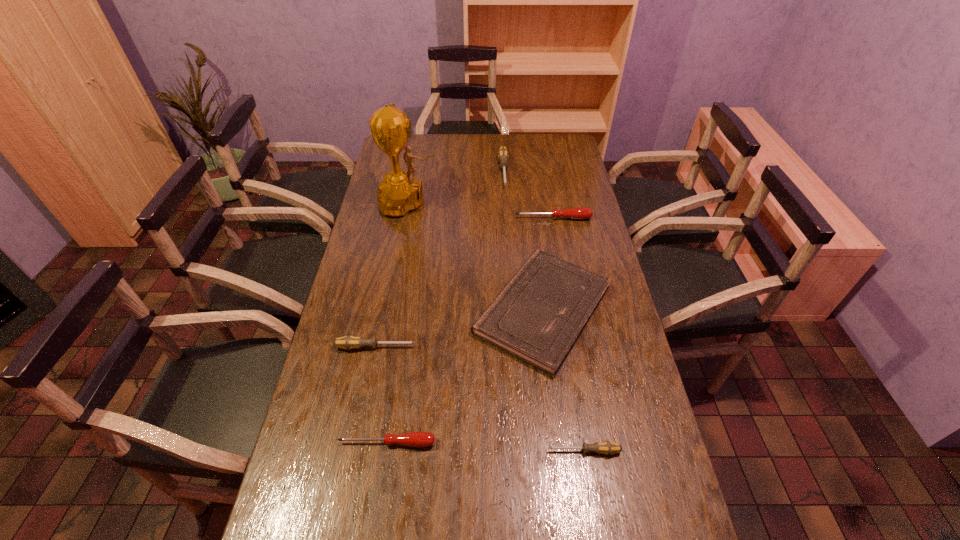
The image size is (960, 540). Identify the location of free space that satisfies the following two spatial constraints: 1. on the back side of the left red screwdriver; 2. on the left side of the paperback book. (407, 310).

Locate an element on the screen. The width and height of the screenshot is (960, 540). free space that satisfies the following two spatial constraints: 1. on the front side of the gold award; 2. on the left side of the nearer red screwdriver is located at coordinates (367, 443).

The height and width of the screenshot is (540, 960). I want to click on free location that satisfies the following two spatial constraints: 1. on the back side of the left red screwdriver; 2. on the front side of the gold award, so click(x=423, y=202).

Identify the location of vacant space that satisfies the following two spatial constraints: 1. at the tip of the farthest screwdriver; 2. at the tip of the second nearest gray screwdriver. This screenshot has width=960, height=540. (516, 347).